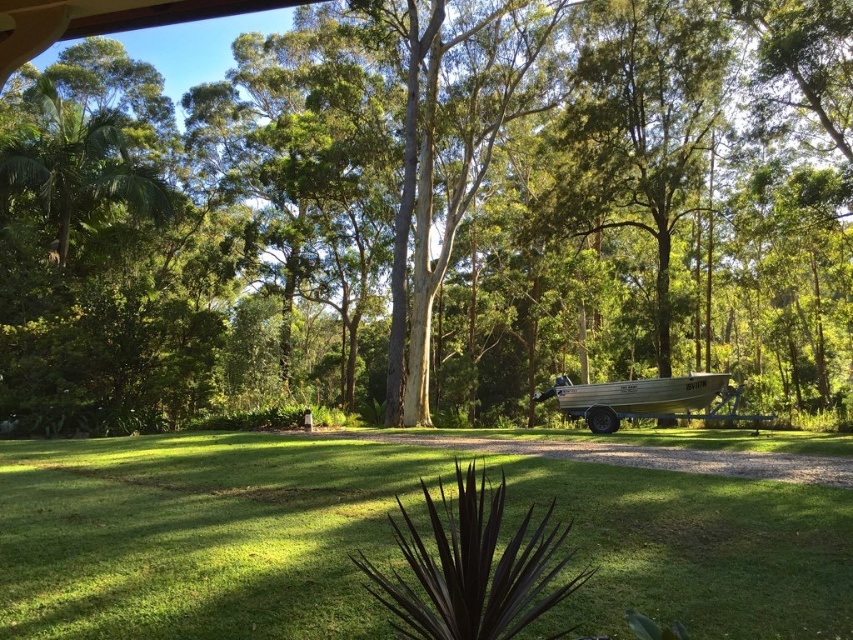
Question: Considering the relative positions of green leafy tree at center and green grassy at center in the image provided, where is green leafy tree at center located with respect to green grassy at center?

Choices:
 (A) above
 (B) below

Answer: (A)

Question: Considering the relative positions of green leafy tree at center and green grassy at center in the image provided, where is green leafy tree at center located with respect to green grassy at center?

Choices:
 (A) right
 (B) left

Answer: (B)

Question: Among these points, which one is nearest to the camera?

Choices:
 (A) (315, 481)
 (B) (734, 413)
 (C) (598, 74)

Answer: (A)

Question: Which point is farther from the camera taking this photo?

Choices:
 (A) (701, 211)
 (B) (219, 506)

Answer: (A)

Question: Which point is closer to the camera taking this photo?

Choices:
 (A) (109, 627)
 (B) (697, 205)
 (C) (637, 404)

Answer: (A)

Question: Can you confirm if green grassy at center is wider than silver aluminum boat at center?

Choices:
 (A) no
 (B) yes

Answer: (B)